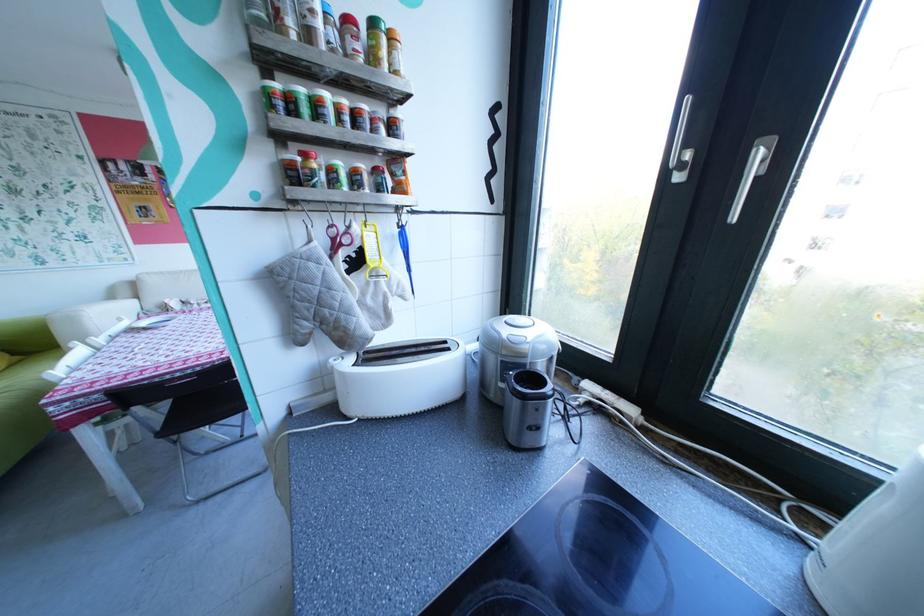
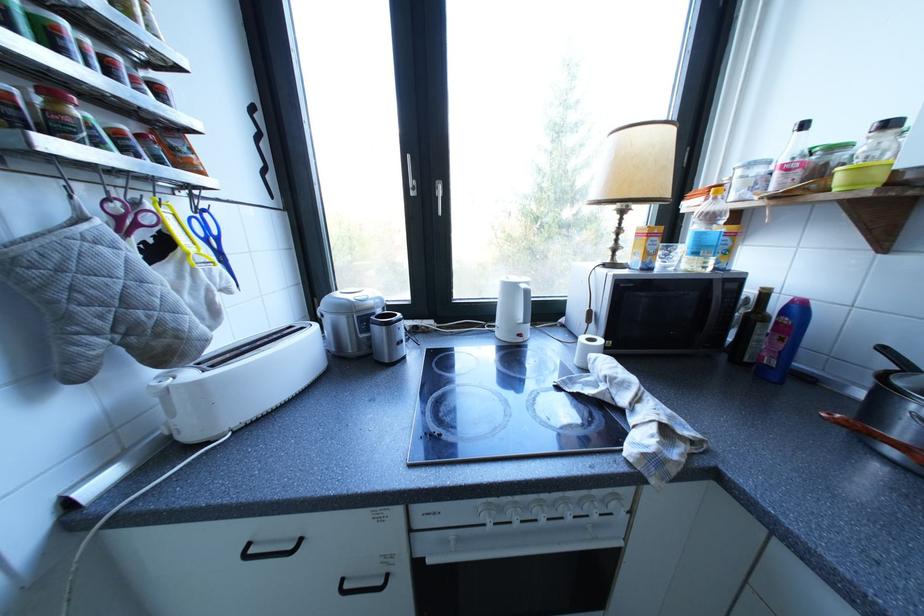
Locate, in the second image, the point that corresponds to pixel 691 177 in the first image.

(426, 193)